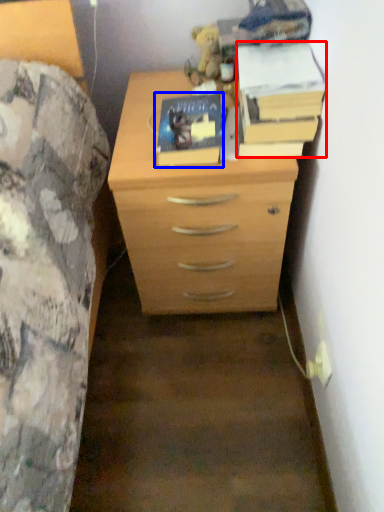
Question: Which of the following is the farthest to the observer, paperback book (highlighted by a red box) or paperback book (highlighted by a blue box)?

Choices:
 (A) paperback book
 (B) paperback book

Answer: (B)